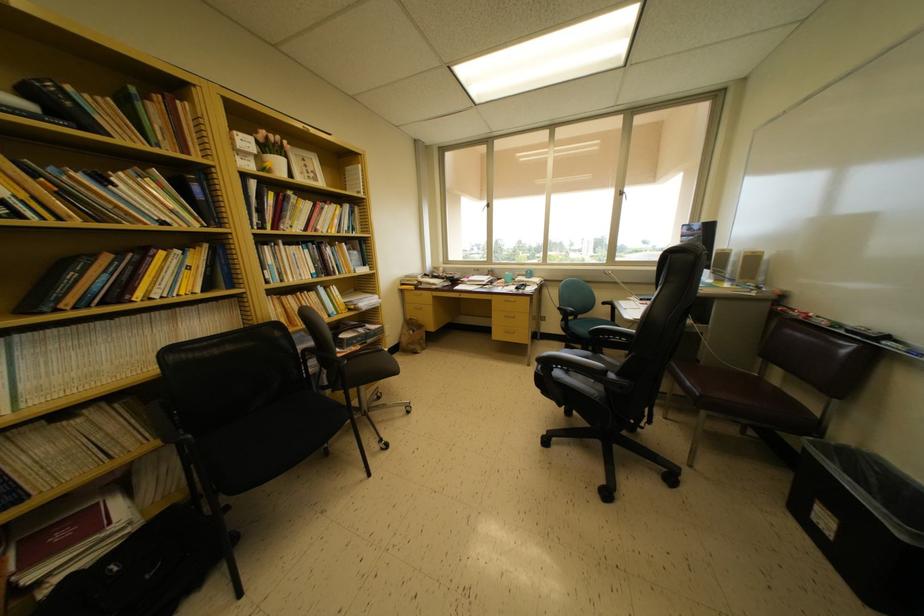
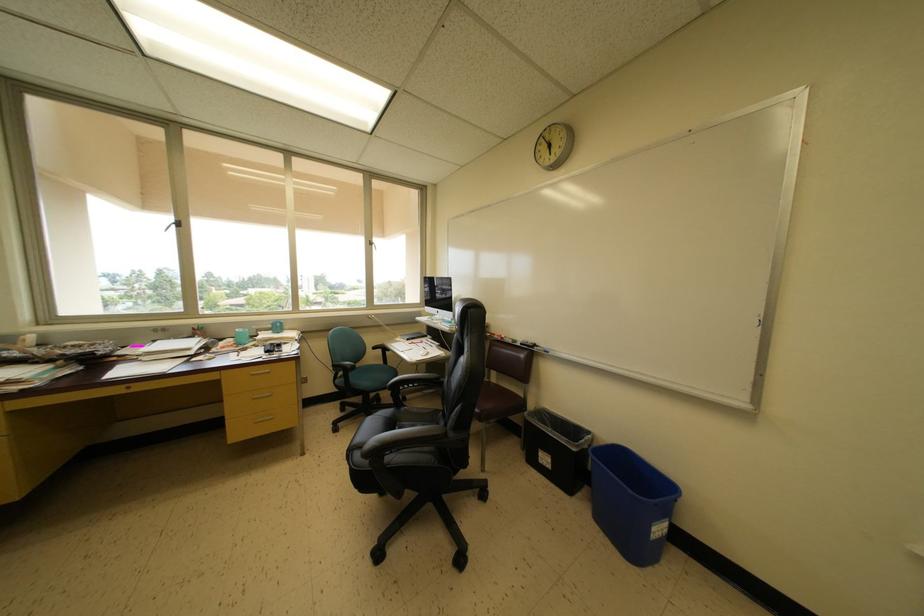
Locate, in the second image, the point that corresponds to point 892,342 in the first image.

(539, 350)